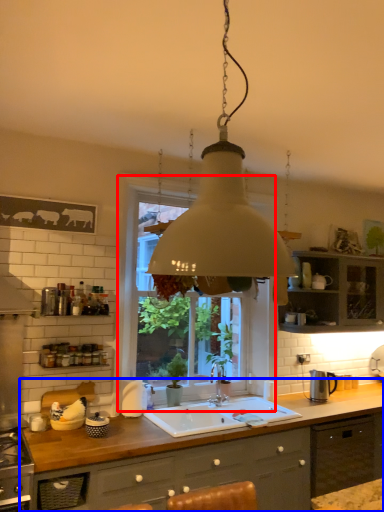
Question: Which object is closer to the camera taking this photo, window (highlighted by a red box) or countertop (highlighted by a blue box)?

Choices:
 (A) window
 (B) countertop

Answer: (B)